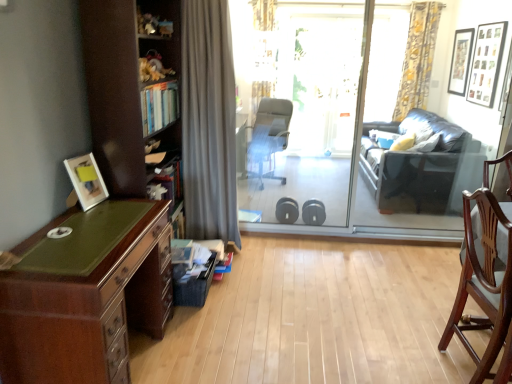
Question: Is gray fabric office chair at center, which ranks as the first chair in back-to-front order, not inside black matte picture frame at upper right, the 1th picture frame in the top-to-bottom sequence?

Choices:
 (A) yes
 (B) no

Answer: (A)

Question: Is gray fabric office chair at center, which ranks as the first chair in back-to-front order, looking in the opposite direction of black matte picture frame at upper right, the third picture frame from the bottom?

Choices:
 (A) yes
 (B) no

Answer: (B)

Question: Does gray fabric office chair at center, which is counted as the second chair, starting from the bottom, lie in front of black matte picture frame at upper right, arranged as the 1th picture frame when viewed from the back?

Choices:
 (A) yes
 (B) no

Answer: (A)

Question: Does gray fabric office chair at center, which ranks as the first chair in back-to-front order, lie behind black matte picture frame at upper right, which is counted as the 3th picture frame, starting from the front?

Choices:
 (A) yes
 (B) no

Answer: (B)

Question: Can you confirm if gray fabric office chair at center, marked as the first chair in a top-to-bottom arrangement, is wider than black matte picture frame at upper right, arranged as the 1th picture frame when viewed from the back?

Choices:
 (A) no
 (B) yes

Answer: (B)

Question: From a real-world perspective, relative to dark blue leather couch at right, is mahogany wood desk at left vertically above or below?

Choices:
 (A) above
 (B) below

Answer: (B)

Question: In terms of size, does mahogany wood desk at left appear bigger or smaller than dark blue leather couch at right?

Choices:
 (A) small
 (B) big

Answer: (A)

Question: Looking at their shapes, would you say mahogany wood desk at left is wider or thinner than dark blue leather couch at right?

Choices:
 (A) wide
 (B) thin

Answer: (B)

Question: In the image, is mahogany wood desk at left positioned in front of or behind dark blue leather couch at right?

Choices:
 (A) behind
 (B) front

Answer: (B)

Question: From a real-world perspective, is yellow floral fabric curtain at upper right, which is the 2th curtain from bottom to top, physically located above or below white glossy picture frame at left, which ranks as the 3th picture frame in back-to-front order?

Choices:
 (A) above
 (B) below

Answer: (A)

Question: Is yellow floral fabric curtain at upper right, the first curtain in the back-to-front sequence, in front of or behind white glossy picture frame at left, which ranks as the 3th picture frame in back-to-front order, in the image?

Choices:
 (A) front
 (B) behind

Answer: (B)

Question: Considering the positions of yellow floral fabric curtain at upper right, which is the 2th curtain from bottom to top, and white glossy picture frame at left, arranged as the first picture frame when viewed from the front, in the image, is yellow floral fabric curtain at upper right, which is the 2th curtain from bottom to top, taller or shorter than white glossy picture frame at left, arranged as the first picture frame when viewed from the front,?

Choices:
 (A) tall
 (B) short

Answer: (A)

Question: Is yellow floral fabric curtain at upper right, which ranks as the 2th curtain in front-to-back order, wider or thinner than white glossy picture frame at left, marked as the first picture frame in a bottom-to-top arrangement?

Choices:
 (A) thin
 (B) wide

Answer: (A)

Question: In the image, is black matte picture frame at upper right, arranged as the 1th picture frame when viewed from the back, positioned in front of or behind gray fabric office chair at center, marked as the first chair in a top-to-bottom arrangement?

Choices:
 (A) behind
 (B) front

Answer: (A)

Question: Visually, is black matte picture frame at upper right, marked as the third picture frame in a left-to-right arrangement, positioned to the left or to the right of gray fabric office chair at center, arranged as the second chair when viewed from the right?

Choices:
 (A) left
 (B) right

Answer: (B)